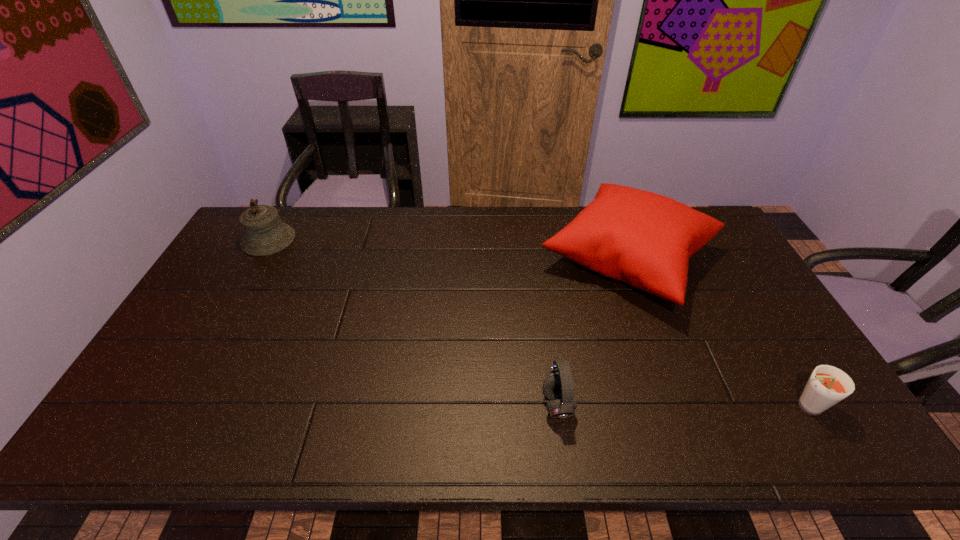
At what (x,y) coordinates should I click in order to perform the action: click on vacant area that lies between the headset and the root beer. Please return your answer as a coordinate pair (x, y). The image size is (960, 540). Looking at the image, I should click on (681, 406).

Locate an element on the screen. The height and width of the screenshot is (540, 960). vacant area between the cushion and the leftmost object is located at coordinates (448, 249).

At what (x,y) coordinates should I click in order to perform the action: click on vacant region between the root beer and the headset. Please return your answer as a coordinate pair (x, y). Looking at the image, I should click on (681, 406).

Find the location of a particular element. The height and width of the screenshot is (540, 960). free space between the leftmost object and the headset is located at coordinates (413, 322).

What are the coordinates of `vacant area that lies between the cushion and the root beer` in the screenshot? It's located at (717, 333).

Choose which object is the second nearest neighbor to the leftmost object. Please provide its 2D coordinates. Your answer should be formatted as a tuple, i.e. [(x, y)], where the tuple contains the x and y coordinates of a point satisfying the conditions above.

[(558, 387)]

Locate which object is the closest to the root beer. Please provide its 2D coordinates. Your answer should be formatted as a tuple, i.e. [(x, y)], where the tuple contains the x and y coordinates of a point satisfying the conditions above.

[(645, 239)]

Where is `vacant region that satisfies the following two spatial constraints: 1. on the front side of the cushion; 2. on the ear cups of the headset`? The height and width of the screenshot is (540, 960). vacant region that satisfies the following two spatial constraints: 1. on the front side of the cushion; 2. on the ear cups of the headset is located at coordinates (684, 405).

The height and width of the screenshot is (540, 960). I want to click on blank area in the image that satisfies the following two spatial constraints: 1. on the front side of the cushion; 2. on the ear cups of the headset, so click(x=684, y=405).

Where is `vacant area that satisfies the following two spatial constraints: 1. on the front side of the cushion; 2. on the ear cups of the headset`? vacant area that satisfies the following two spatial constraints: 1. on the front side of the cushion; 2. on the ear cups of the headset is located at coordinates (684, 405).